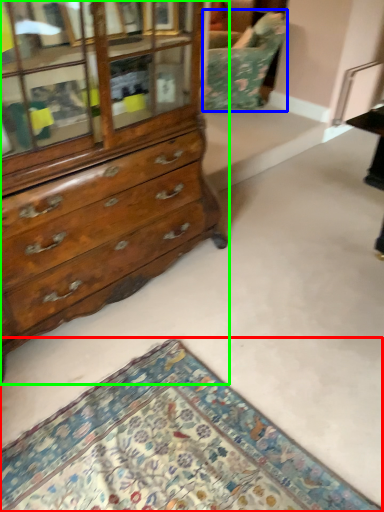
Question: Based on their relative distances, which object is nearer to mat (highlighted by a red box)? Choose from swivel chair (highlighted by a blue box) and chest of drawers (highlighted by a green box).

Choices:
 (A) swivel chair
 (B) chest of drawers

Answer: (B)